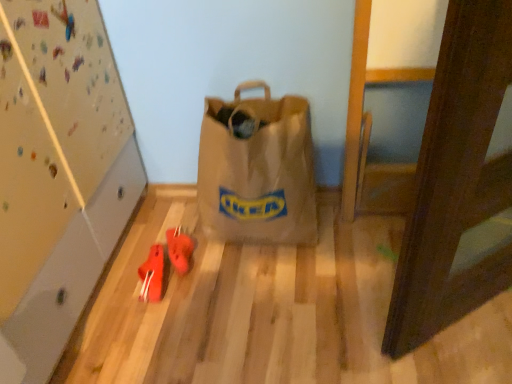
This screenshot has height=384, width=512. What are the coordinates of `free spot to the left of brown paper bag at center` in the screenshot? It's located at (155, 237).